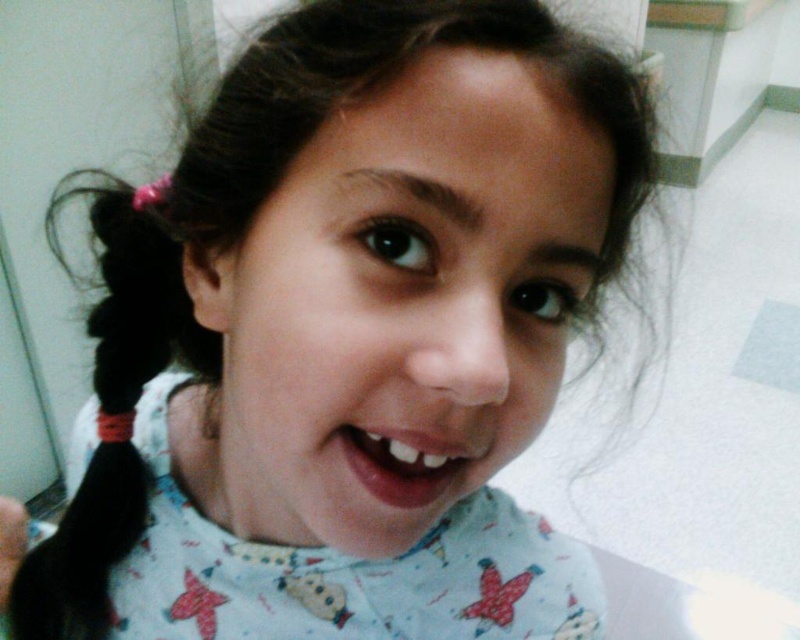
Question: Among these objects, which one is farthest from the camera?

Choices:
 (A) smooth skin face at center
 (B) black silky hair at left
 (C) smooth skin mouth at center

Answer: (B)

Question: Does smooth skin face at center have a larger size compared to smooth skin mouth at center?

Choices:
 (A) yes
 (B) no

Answer: (A)

Question: Which point is farther from the camera taking this photo?

Choices:
 (A) (421, 440)
 (B) (92, 525)

Answer: (B)

Question: Is black silky hair at left closer to camera compared to smooth skin mouth at center?

Choices:
 (A) yes
 (B) no

Answer: (B)

Question: Does black silky hair at left appear on the left side of smooth skin mouth at center?

Choices:
 (A) no
 (B) yes

Answer: (B)

Question: Which object is the closest to the smooth skin mouth at center?

Choices:
 (A) smooth skin face at center
 (B) black silky hair at left

Answer: (A)